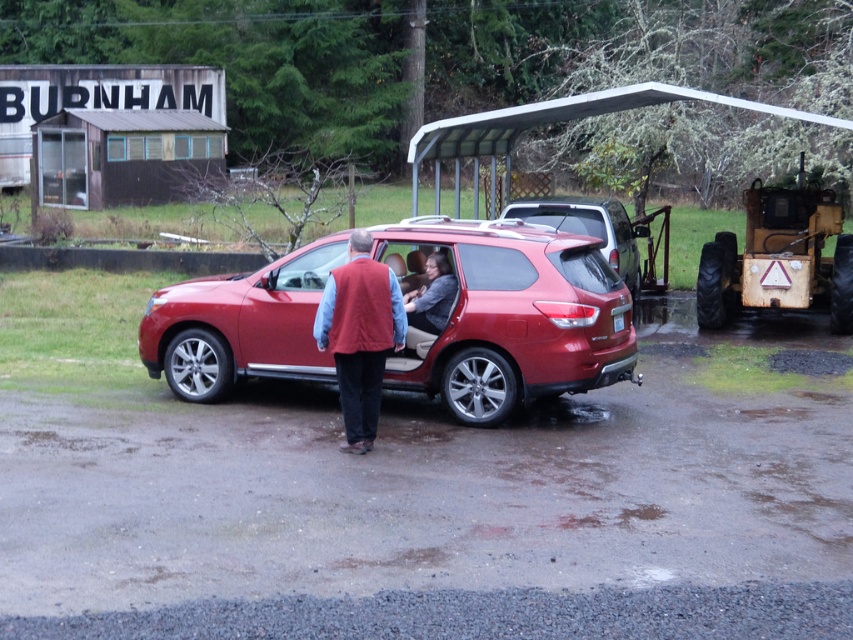
You are a delivery person who needs to determine which clothing item is taller between the red wool vest at center and the matte gray sweater at center. Based on the scene, which one should you choose?

The red wool vest at center is taller than the matte gray sweater at center, so you should choose the red wool vest at center.

You are standing at the viewpoint in the image and want to reach the point marked as point (550,268). If your walking speed is 3 feet per second, how many seconds will it take you to reach there?

The point (550,268) is 31.62 feet away from the viewer. At a walking speed of 3 feet per second, it would take approximately 10.54 seconds to reach there.

You are a delivery person needing to place a package on top of the shiny metallic suv at center. Can you do so without stepping on the red wool vest at center?

The shiny metallic suv at center is above the red wool vest at center, so yes, you can place the package on top of the shiny metallic suv at center without stepping on the red wool vest at center.